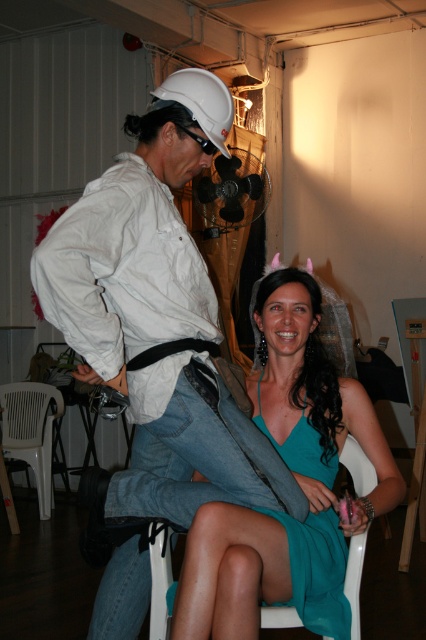
This screenshot has height=640, width=426. What do you see at coordinates (317, 572) in the screenshot? I see `teal chiffon dress at center` at bounding box center [317, 572].

Is the position of teal chiffon dress at center more distant than that of white plastic folding chair at lower left?

No, teal chiffon dress at center is closer to the viewer.

Between point (328, 513) and point (58, 390), which one is positioned behind?

The point (58, 390) is behind.

Find the location of a particular element. This screenshot has width=426, height=640. teal chiffon dress at center is located at coordinates (317, 572).

Is white matte hard hat at upper left positioned before teal chiffon dress at center?

Yes, it is in front of teal chiffon dress at center.

Measure the distance between white matte hard hat at upper left and camera.

They are 1.43 meters apart.

Where is `white matte hard hat at upper left`? white matte hard hat at upper left is located at coordinates [158, 317].

Can you confirm if white matte hard hat at upper left is bigger than black plastic goggles at upper center?

Yes, white matte hard hat at upper left is bigger than black plastic goggles at upper center.

Locate an element on the screen. The height and width of the screenshot is (640, 426). white matte hard hat at upper left is located at coordinates (158, 317).

Between point (236, 456) and point (213, 147), which one is positioned in front?

Positioned in front is point (236, 456).

Locate an element on the screen. The image size is (426, 640). white matte hard hat at upper left is located at coordinates (158, 317).